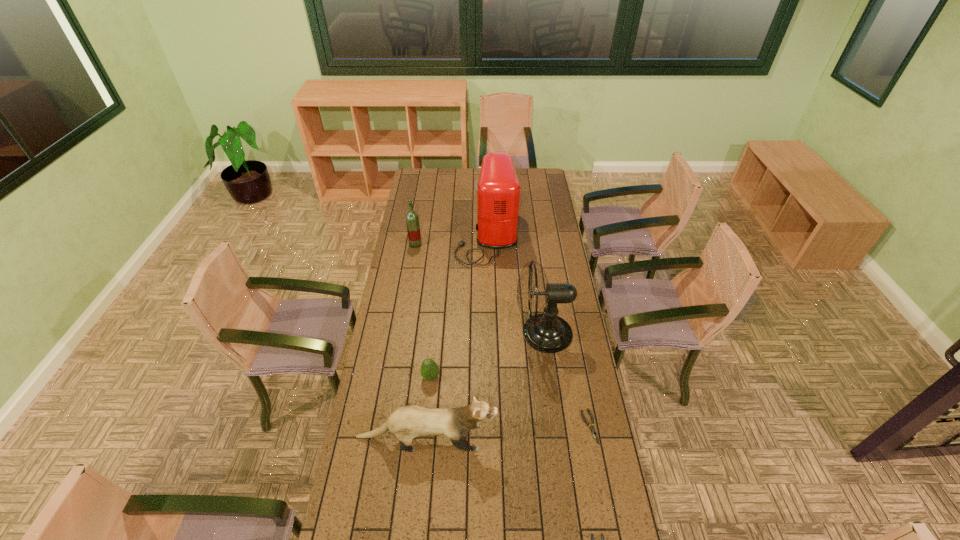
Locate an element on the screen. The image size is (960, 540). fan positioned at the right edge is located at coordinates (547, 332).

What are the coordinates of `pliers located in the right edge section of the desktop` in the screenshot? It's located at (592, 428).

At what (x,y) coordinates should I click in order to perform the action: click on vacant space at the far edge. Please return your answer as a coordinate pair (x, y). Looking at the image, I should click on (444, 185).

This screenshot has width=960, height=540. In order to click on vacant space at the left edge of the desktop in this screenshot , I will do (387, 358).

Find the location of a particular element. vacant region at the far left corner of the desktop is located at coordinates (422, 176).

The width and height of the screenshot is (960, 540). I want to click on free space between the fan and the shorter pliers, so click(566, 380).

The image size is (960, 540). Find the location of `unoccupied position between the shortest object and the fifth tallest object`. unoccupied position between the shortest object and the fifth tallest object is located at coordinates (510, 402).

Locate an element on the screen. This screenshot has height=540, width=960. empty space that is in between the fourth tallest object and the fourth farthest object is located at coordinates (429, 407).

Image resolution: width=960 pixels, height=540 pixels. Find the location of `vacant area that lies between the liquor and the fan`. vacant area that lies between the liquor and the fan is located at coordinates click(479, 289).

Identify the location of object that is the closest one to the shortest object. This screenshot has width=960, height=540. (547, 332).